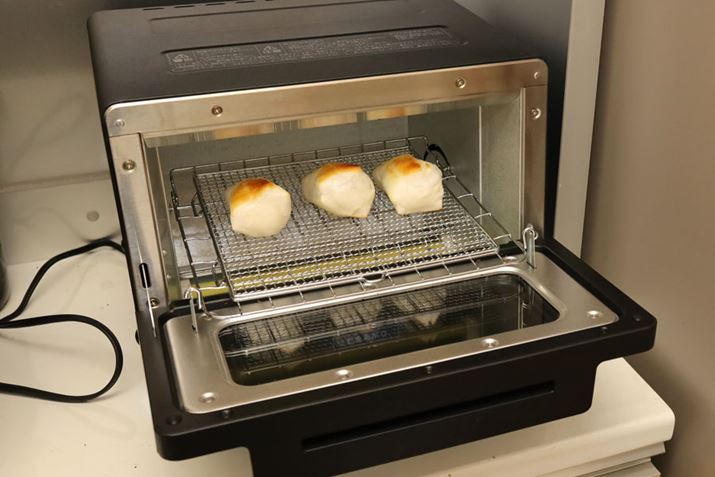
Locate an element on the screen. top of toaster is located at coordinates (121, 28), (458, 11).